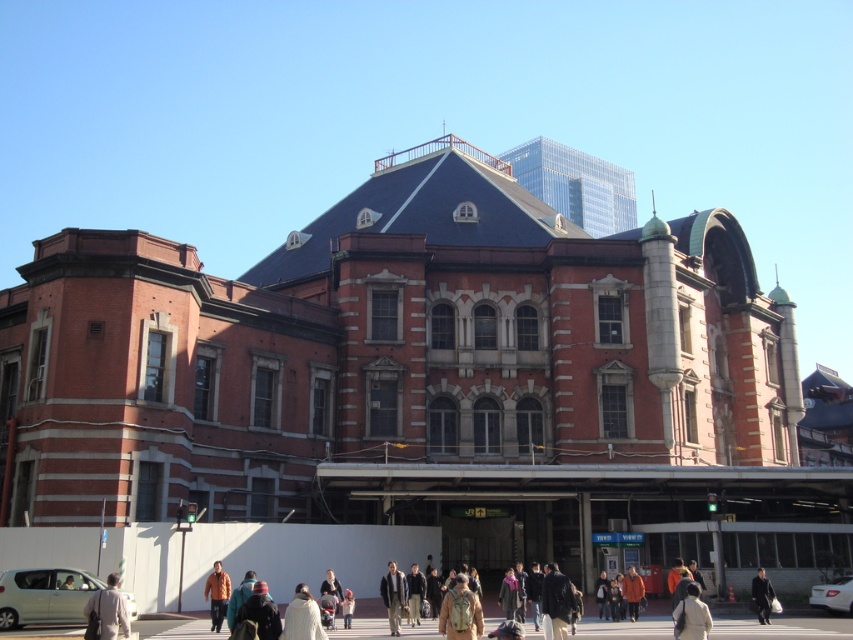
You are standing on the pedestrian crossing in front of the historic building. You see two people wearing jackets. One is wearing a brown leather jacket at center and the other an orange jacket at center. Which jacket is covering the other?

The brown leather jacket at center is positioned over orange jacket at center, so it is covering the orange jacket at center.